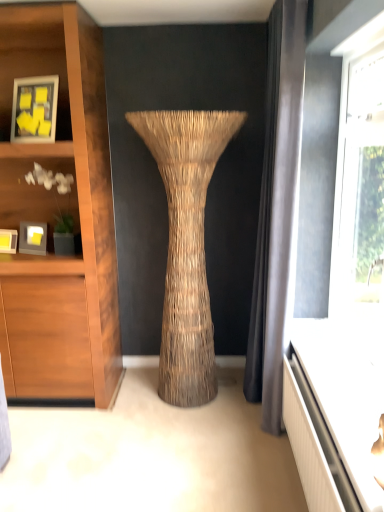
Identify the location of blank space situated above white glossy vanity at lower right (from a real-world perspective). (340, 385).